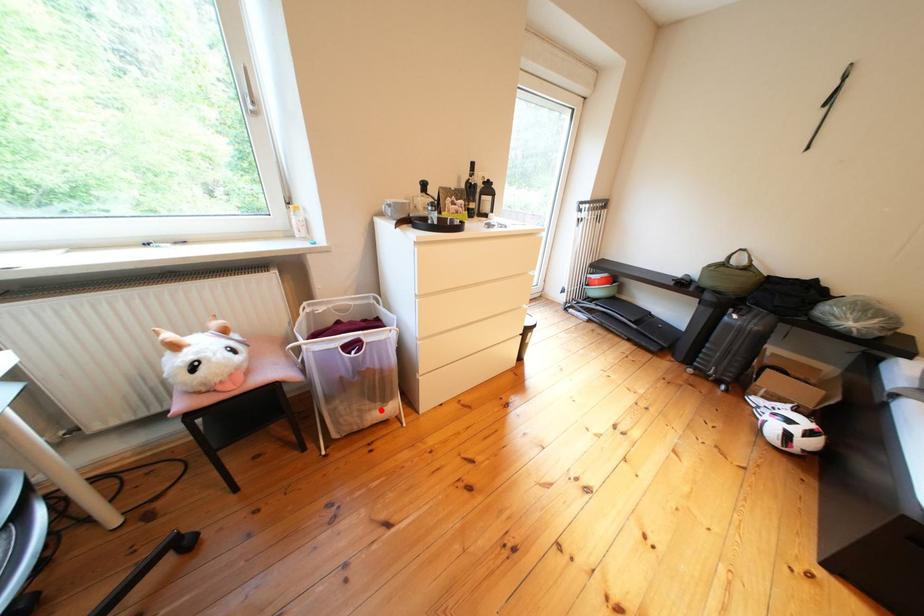
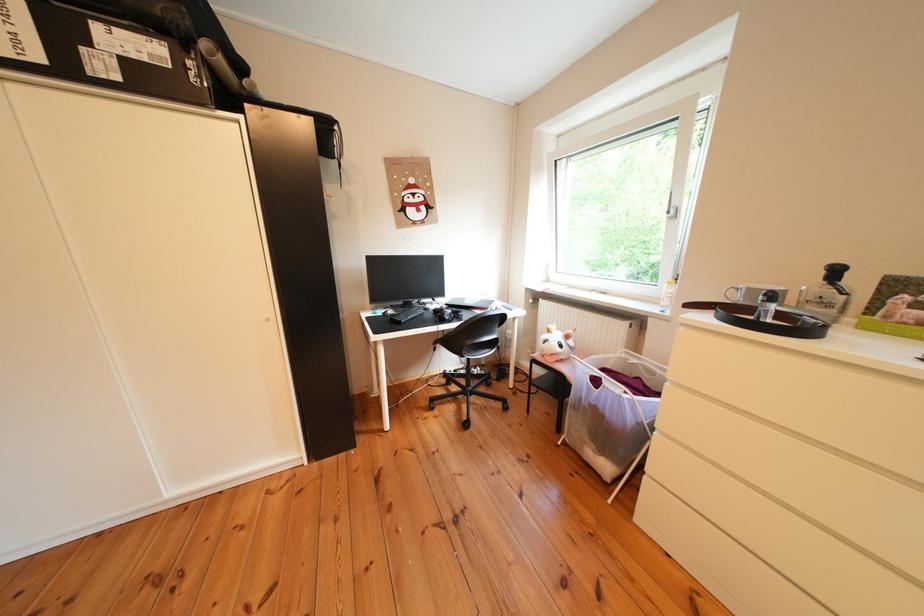
In the second image, find the point that corresponds to the highlighted location in the first image.

(601, 442)